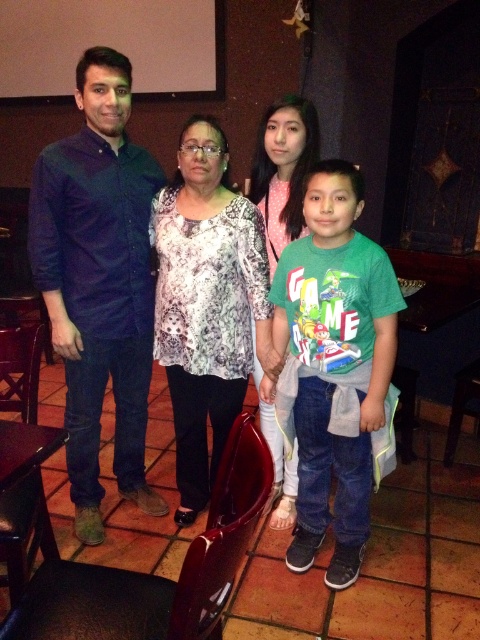
What are the coordinates of `dark blue corduroy shirt at left` in the screenshot? It's located at (98, 282).

Does dark blue corduroy shirt at left appear on the right side of green cotton shirt at center?

Incorrect, dark blue corduroy shirt at left is not on the right side of green cotton shirt at center.

Between point (135, 420) and point (350, 504), which one is positioned behind?

Point (135, 420)

Locate an element on the screen. Image resolution: width=480 pixels, height=640 pixels. dark blue corduroy shirt at left is located at coordinates (98, 282).

Does dark blue corduroy shirt at left come behind printed fabric blouse at center?

No, dark blue corduroy shirt at left is closer to the viewer.

Which of these two, dark blue corduroy shirt at left or printed fabric blouse at center, stands taller?

With more height is dark blue corduroy shirt at left.

Does point (105, 304) come farther from viewer compared to point (228, 324)?

Yes, point (105, 304) is behind point (228, 324).

Locate an element on the screen. The height and width of the screenshot is (640, 480). dark blue corduroy shirt at left is located at coordinates click(x=98, y=282).

Is the position of printed fabric blouse at center more distant than that of pink dotted blouse at center?

No.

Who is more distant from viewer, (204, 150) or (287, 464)?

Positioned behind is point (287, 464).

Does point (177, 390) come farther from viewer compared to point (275, 230)?

No, (177, 390) is closer to viewer.

The height and width of the screenshot is (640, 480). In order to click on printed fabric blouse at center in this screenshot , I will do `click(206, 305)`.